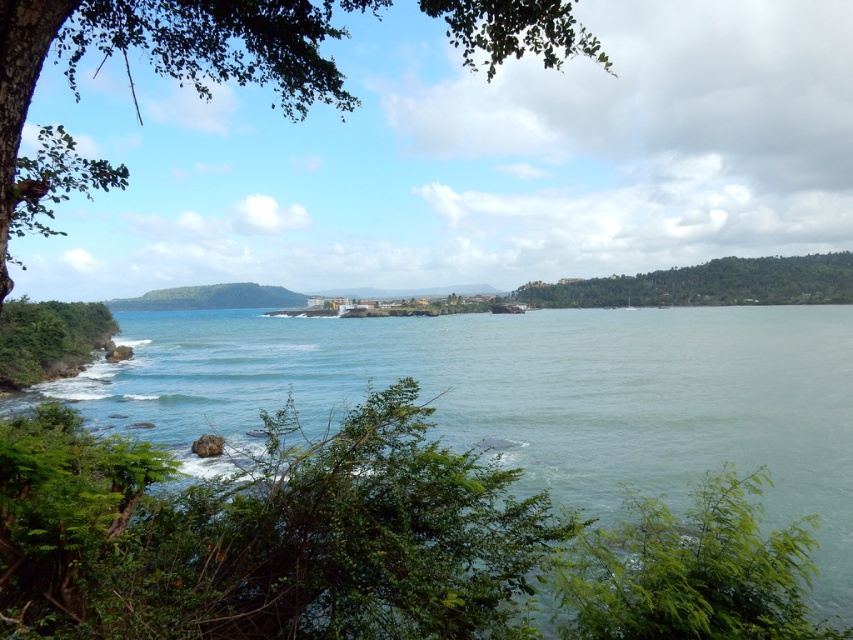
You are standing in the coastal scene and want to take a photo of both the green leafy shrub at lower right and the green leafy tree at right. Which one should you focus on first to ensure both are in sharp focus?

You should focus on the green leafy tree at right first because the green leafy shrub at lower right is closer to the viewer, so adjusting focus starting from the farther object ensures both are in focus.

You are a hiker who has just arrived at the coastal area. You see the clear blue water at center and the green leafy tree at right. Which object is closer to the ocean?

The clear blue water at center is positioned under the green leafy tree at right, meaning it is closer to the ocean than the tree.

You are a hiker planning to cross from the green leafy tree at upper left to the green leafy tree at right. The path between them is rocky and uneven. If your backpack can carry a maximum load of 20 kilograms, and each meter of rocky terrain requires an additional 0.5 kilograms of effort, can you safely make the journey without exceeding your backpack capacity?

The distance between the green leafy tree at upper left and the green leafy tree at right is 103.57 meters. Each meter requires 0.5 kg of effort, totaling 51.785 kilograms. This exceeds your backpack capacity of 20 kilograms, so you cannot safely make the journey.